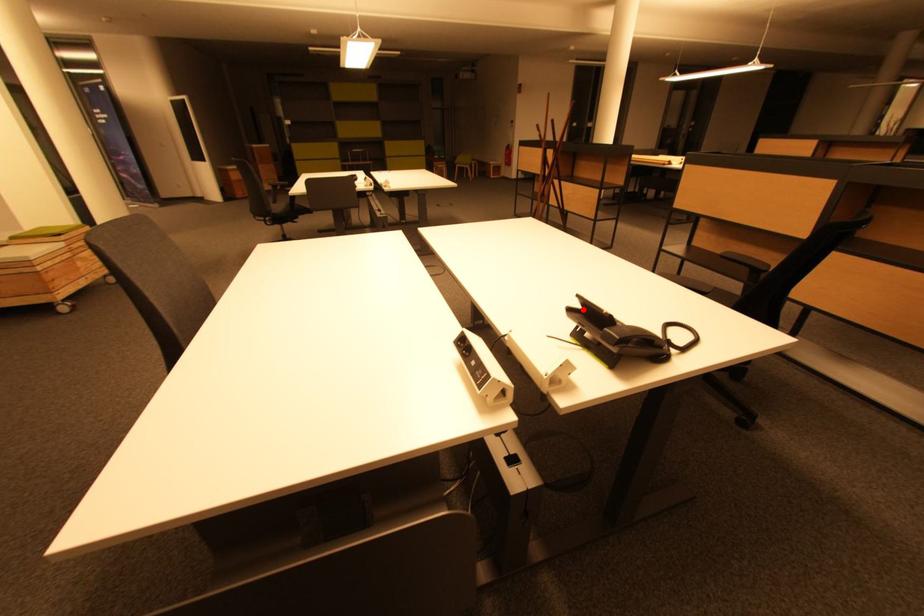
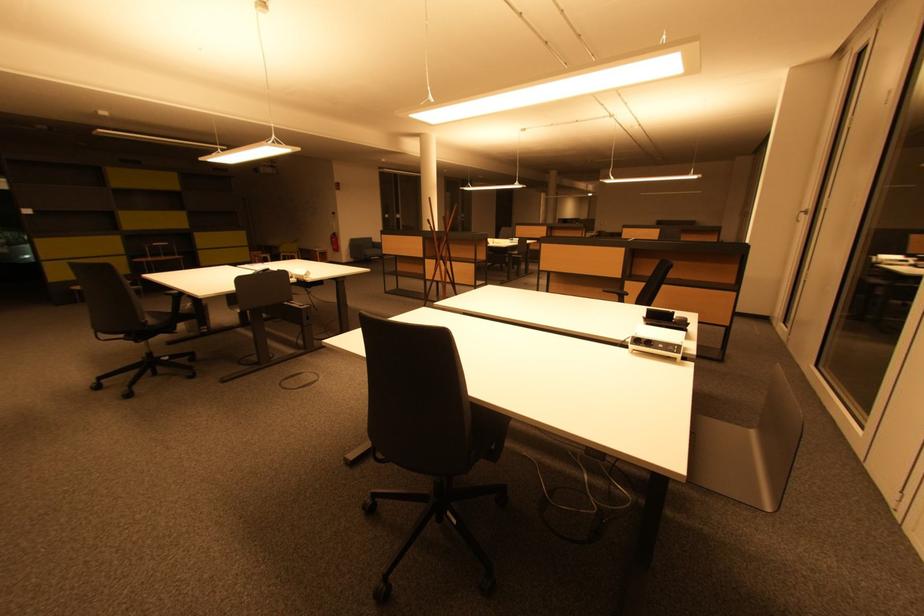
Question: I am providing you with two images of the same scene from different viewpoints. A red point is shown in image1. For the corresponding object point in image2, is it positioned nearer or farther from the camera?

Choices:
 (A) Nearer
 (B) Farther

Answer: (A)